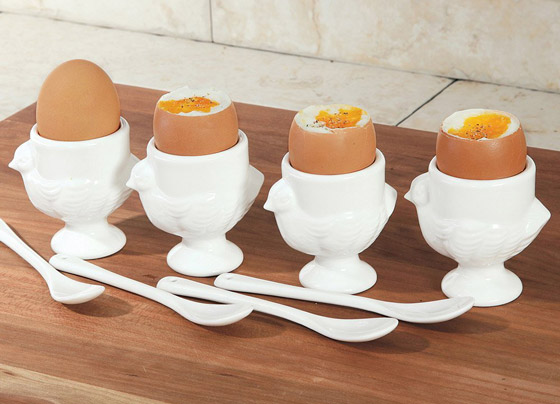
Identify the location of wall. Image resolution: width=560 pixels, height=404 pixels. (423, 40).